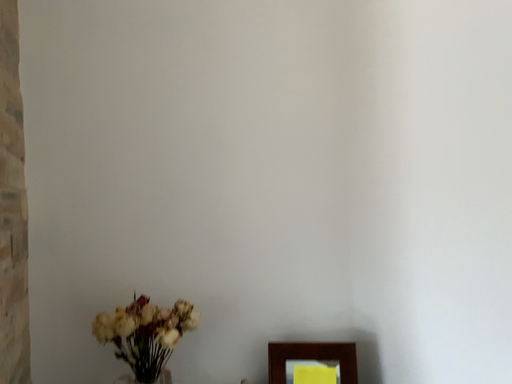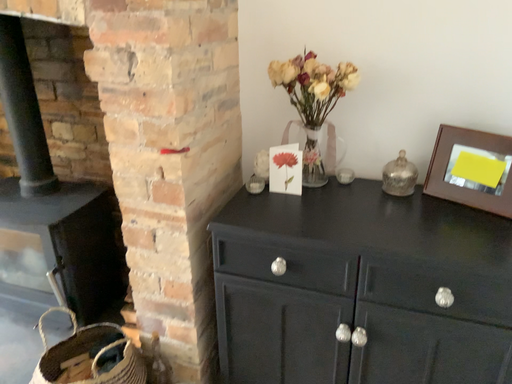
Question: How did the camera likely rotate when shooting the video?

Choices:
 (A) rotated left
 (B) rotated right

Answer: (A)